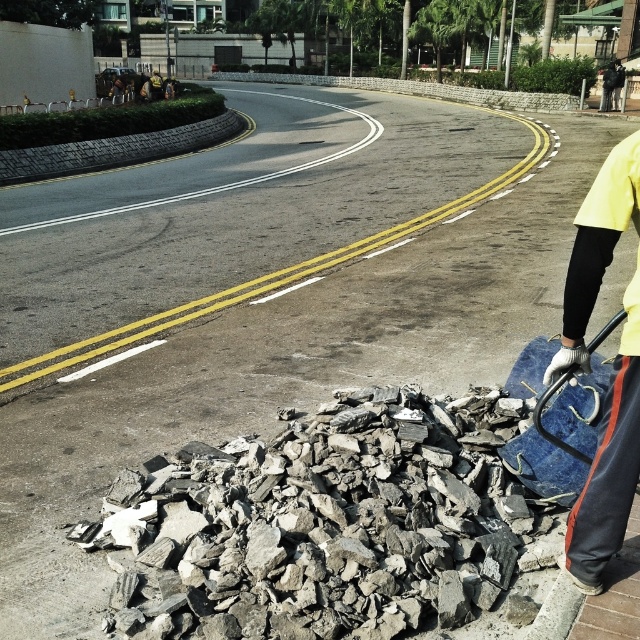
Question: Where is gray rough rocks at lower center located in relation to yellow fabric at right in the image?

Choices:
 (A) left
 (B) right

Answer: (A)

Question: Can you confirm if gray rough rocks at lower center is thinner than yellow fabric at right?

Choices:
 (A) no
 (B) yes

Answer: (A)

Question: Can you confirm if gray rough rocks at lower center is smaller than yellow fabric at right?

Choices:
 (A) yes
 (B) no

Answer: (B)

Question: Which object appears closest to the camera in this image?

Choices:
 (A) gray rough rocks at lower center
 (B) yellow fabric at right

Answer: (B)

Question: Which of the following is the farthest from the observer?

Choices:
 (A) click(284, 513)
 (B) click(566, 308)

Answer: (A)

Question: Which point appears closest to the camera in this image?

Choices:
 (A) (586, 580)
 (B) (324, 492)

Answer: (A)